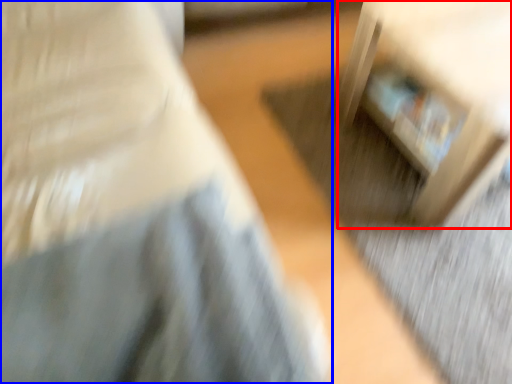
Question: Among these objects, which one is nearest to the camera, furniture (highlighted by a red box) or furniture (highlighted by a blue box)?

Choices:
 (A) furniture
 (B) furniture

Answer: (B)